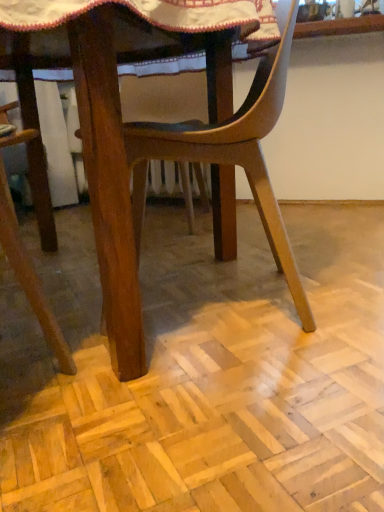
Question: Is wooden chair at center in front of or behind light brown wood parquet floor at center in the image?

Choices:
 (A) behind
 (B) front

Answer: (A)

Question: Is wooden chair at center to the left or to the right of light brown wood parquet floor at center in the image?

Choices:
 (A) left
 (B) right

Answer: (A)

Question: From the image's perspective, is wooden chair at center located above or below light brown wood parquet floor at center?

Choices:
 (A) above
 (B) below

Answer: (A)

Question: Is light brown wood parquet floor at center taller or shorter than wooden chair at center?

Choices:
 (A) short
 (B) tall

Answer: (A)

Question: Looking at the image, does light brown wood parquet floor at center seem bigger or smaller compared to wooden chair at center?

Choices:
 (A) big
 (B) small

Answer: (B)

Question: Considering the positions of point (145, 509) and point (100, 117), is point (145, 509) closer or farther from the camera than point (100, 117)?

Choices:
 (A) closer
 (B) farther

Answer: (A)

Question: Considering the relative positions of light brown wood parquet floor at center and wooden chair at center in the image provided, is light brown wood parquet floor at center to the left or to the right of wooden chair at center?

Choices:
 (A) right
 (B) left

Answer: (A)